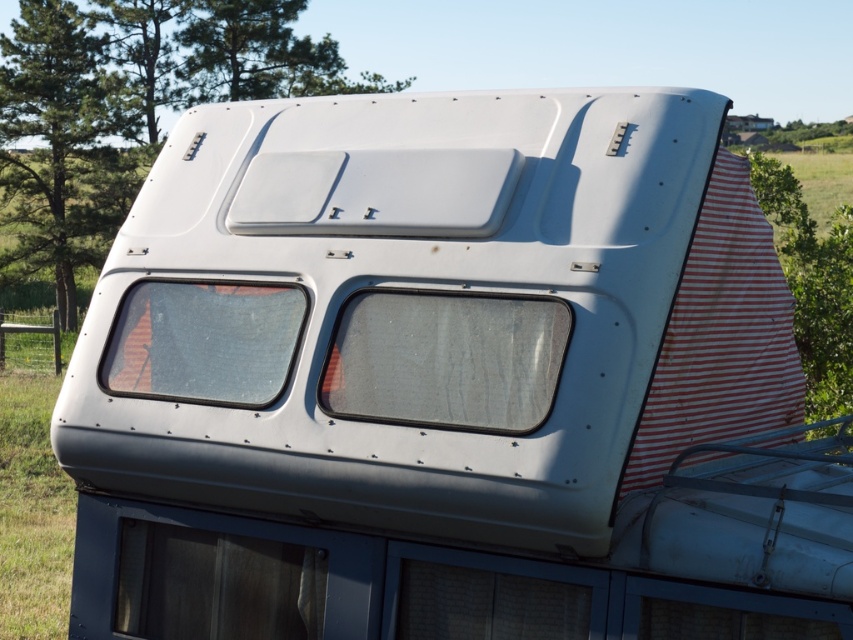
You are planning to install a new solar panel on the roof of the RV. The solar panel requires a mounting area that is larger than the wooden panel at lower left. Can the transparent glass window at lower left provide enough space for the solar panel?

The wooden panel at lower left is smaller than the transparent glass window at lower left. Since the solar panel needs an area larger than the wooden panel, the transparent glass window at lower left may be a suitable location as it is larger in size.

You are standing on the roof of the RV and looking down at the wooden panel at lower left and the transparent glass window at lower left. Which object is positioned to the right side from your perspective?

The wooden panel at lower left is to the right of the transparent glass window at lower left, so the wooden panel at lower left is positioned to the right side from your perspective.